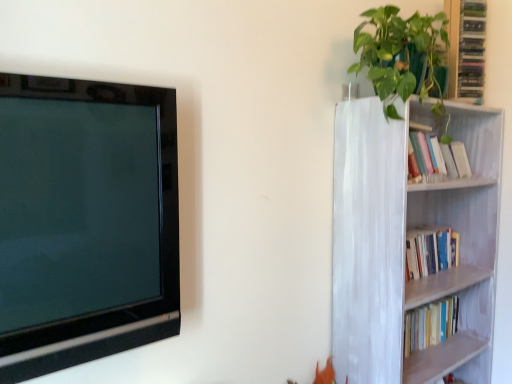
Question: From the image's perspective, is black glossy television at left beneath green glossy cabinet at upper right?

Choices:
 (A) no
 (B) yes

Answer: (B)

Question: Can you confirm if black glossy television at left is shorter than green glossy cabinet at upper right?

Choices:
 (A) no
 (B) yes

Answer: (A)

Question: Is the depth of black glossy television at left less than that of green glossy cabinet at upper right?

Choices:
 (A) yes
 (B) no

Answer: (A)

Question: Does black glossy television at left appear on the right side of green glossy cabinet at upper right?

Choices:
 (A) yes
 (B) no

Answer: (B)

Question: From the image's perspective, does black glossy television at left appear higher than green glossy cabinet at upper right?

Choices:
 (A) no
 (B) yes

Answer: (A)

Question: Would you say green glossy plant at upper right is inside or outside black glossy television at left?

Choices:
 (A) outside
 (B) inside

Answer: (A)

Question: Is green glossy plant at upper right bigger or smaller than black glossy television at left?

Choices:
 (A) small
 (B) big

Answer: (B)

Question: From the image's perspective, is green glossy plant at upper right above or below black glossy television at left?

Choices:
 (A) above
 (B) below

Answer: (A)

Question: Is green glossy plant at upper right wider or thinner than black glossy television at left?

Choices:
 (A) thin
 (B) wide

Answer: (B)

Question: From a real-world perspective, is green glossy plant at upper right positioned above or below white painted wood bookcase at right?

Choices:
 (A) below
 (B) above

Answer: (B)

Question: Considering the positions of green glossy plant at upper right and white painted wood bookcase at right in the image, is green glossy plant at upper right bigger or smaller than white painted wood bookcase at right?

Choices:
 (A) small
 (B) big

Answer: (A)

Question: From the image's perspective, is green glossy plant at upper right above or below white painted wood bookcase at right?

Choices:
 (A) below
 (B) above

Answer: (B)

Question: Relative to white painted wood bookcase at right, is green glossy plant at upper right in front or behind?

Choices:
 (A) behind
 (B) front

Answer: (B)

Question: Is point (461, 51) closer or farther from the camera than point (47, 87)?

Choices:
 (A) closer
 (B) farther

Answer: (B)

Question: From a real-world perspective, is green glossy cabinet at upper right above or below black glossy television at left?

Choices:
 (A) below
 (B) above

Answer: (B)